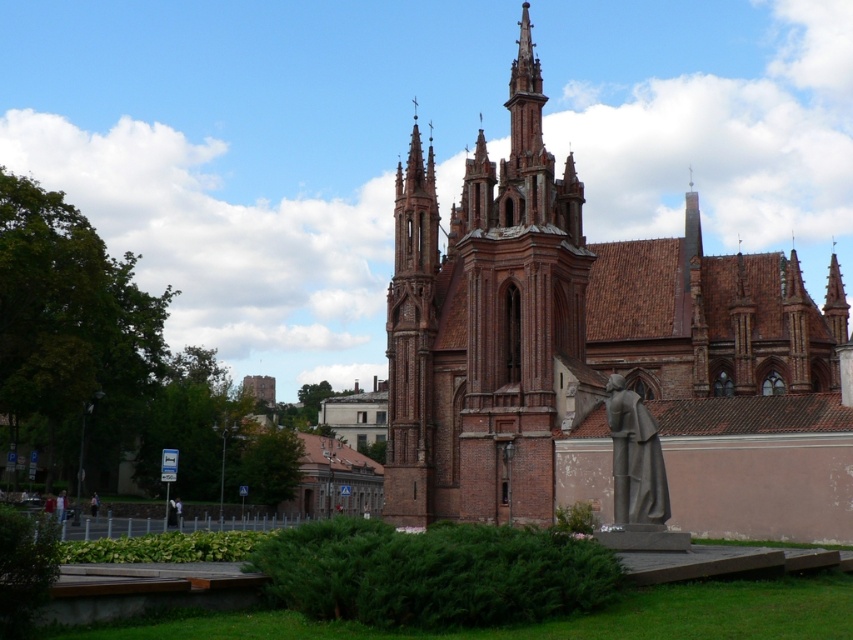
Question: Based on their relative distances, which object is farther from the red brick church at center?

Choices:
 (A) light brown fabric jacket at lower left
 (B) bronze statue at lower right

Answer: (A)

Question: Is red brick church at center to the right of bronze statue at lower right from the viewer's perspective?

Choices:
 (A) yes
 (B) no

Answer: (B)

Question: Considering the real-world distances, which object is farthest from the red brick church at center?

Choices:
 (A) bronze statue at lower right
 (B) light brown fabric jacket at lower left

Answer: (B)

Question: Can you confirm if bronze statue at lower right is wider than light brown fabric jacket at lower left?

Choices:
 (A) no
 (B) yes

Answer: (B)

Question: Among these points, which one is farthest from the camera?

Choices:
 (A) (606, 374)
 (B) (91, 502)

Answer: (B)

Question: Does red brick church at center come behind light brown fabric jacket at lower left?

Choices:
 (A) yes
 (B) no

Answer: (B)